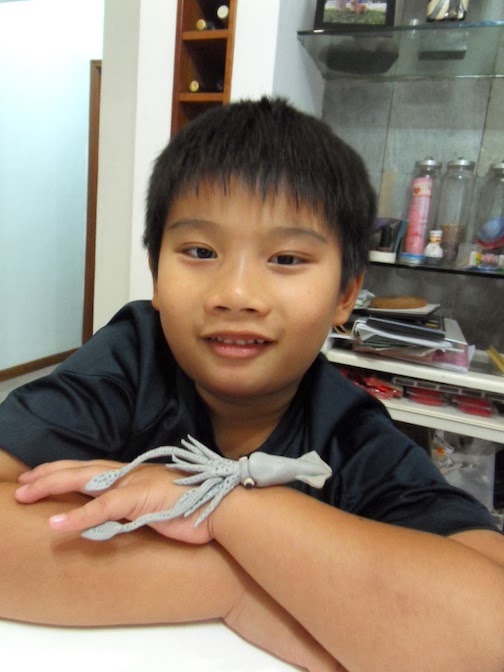
What are the coordinates of `glass shelf, top right` in the screenshot? It's located at click(x=467, y=52).